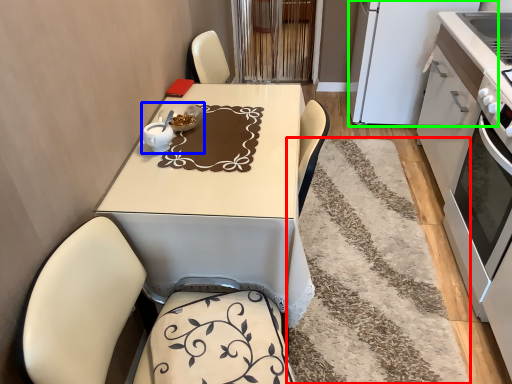
Question: Considering the real-world distances, which object is closest to mat (highlighted by a red box)? tableware (highlighted by a blue box) or appliance (highlighted by a green box).

Choices:
 (A) tableware
 (B) appliance

Answer: (B)